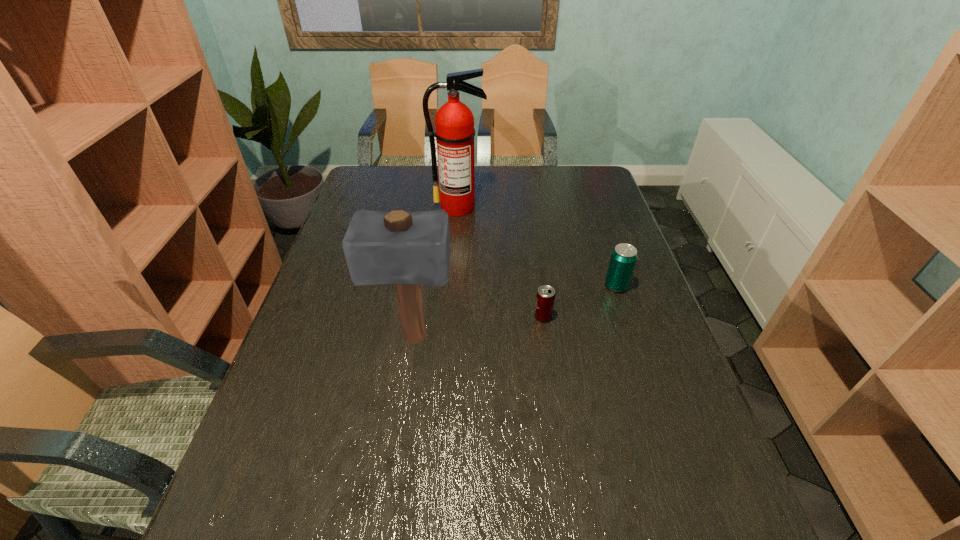
The image size is (960, 540). I want to click on the tallest object, so click(x=454, y=122).

Where is `the farthest object`? the farthest object is located at coordinates (454, 122).

At what (x,y) coordinates should I click in order to perform the action: click on the second tallest object. Please return your answer as a coordinate pair (x, y). The width and height of the screenshot is (960, 540). Looking at the image, I should click on (408, 249).

You are a GUI agent. You are given a task and a screenshot of the screen. Output one action in this format:
    pyautogui.click(x=<x>, y=<y>)
    Task: Click on the farther beer can
    The image size is (960, 540).
    Given the screenshot: What is the action you would take?
    pyautogui.click(x=623, y=259)

What are the coordinates of `the second shortest object` in the screenshot? It's located at (623, 259).

Image resolution: width=960 pixels, height=540 pixels. Identify the location of the second object from right to left. (545, 298).

You are a GUI agent. You are given a task and a screenshot of the screen. Output one action in this format:
    pyautogui.click(x=<x>, y=<y>)
    Task: Click on the left beer can
    This screenshot has height=540, width=960.
    Given the screenshot: What is the action you would take?
    pyautogui.click(x=545, y=298)

I want to click on free space located on the side of the farthest object near the handle, so click(457, 228).

Where is `vacant space located 0.220m on the right of the mallet`? The height and width of the screenshot is (540, 960). vacant space located 0.220m on the right of the mallet is located at coordinates (543, 338).

This screenshot has height=540, width=960. In order to click on vacant space located 0.200m on the left of the third nearest object in this screenshot , I will do `click(533, 286)`.